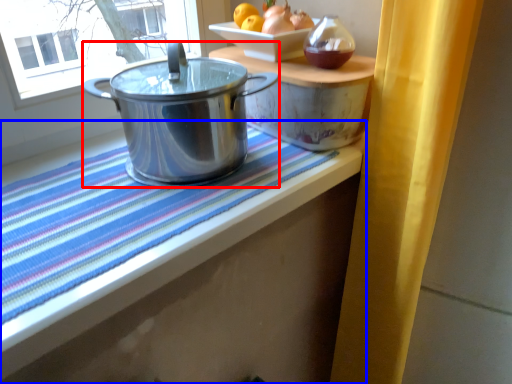
Question: Among these objects, which one is nearest to the camera, kitchen appliance (highlighted by a red box) or table (highlighted by a blue box)?

Choices:
 (A) kitchen appliance
 (B) table

Answer: (B)